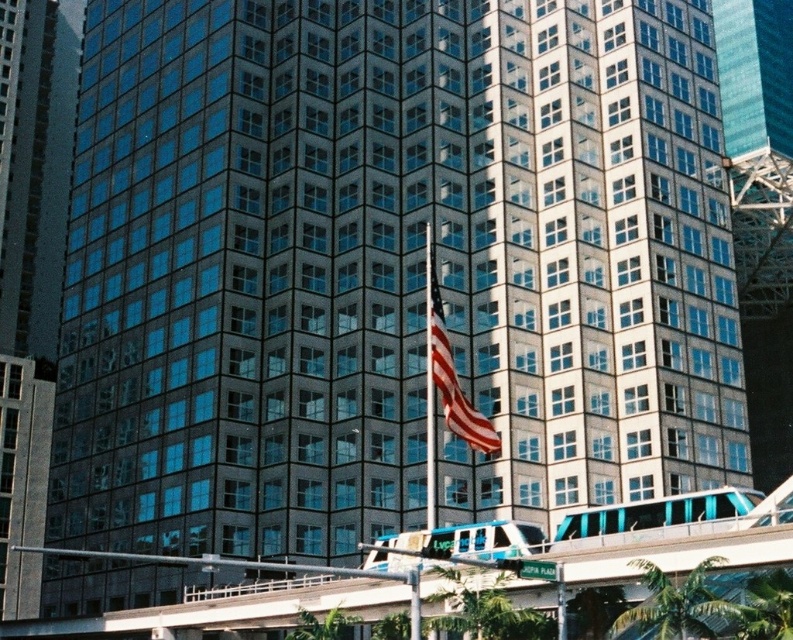
Question: Observing the image, what is the correct spatial positioning of teal glossy monorail at center in reference to american flag at center?

Choices:
 (A) left
 (B) right

Answer: (B)

Question: Is teal glossy monorail at center above american flag at center?

Choices:
 (A) no
 (B) yes

Answer: (A)

Question: Which point is closer to the camera taking this photo?

Choices:
 (A) (623, 625)
 (B) (439, 348)
 (C) (426, 536)

Answer: (A)

Question: Which object is positioned closest to the teal glossy monorail at center?

Choices:
 (A) green leafy palm tree at lower right
 (B) teal glossy train at center
 (C) american flag at center

Answer: (B)

Question: Which of the following is the farthest from the observer?

Choices:
 (A) american flag at center
 (B) teal glossy monorail at center
 (C) green leafy palm tree at lower right
 (D) teal glossy train at center

Answer: (D)

Question: Can you confirm if green leafy palm tree at lower right is positioned above american flag at center?

Choices:
 (A) no
 (B) yes

Answer: (A)